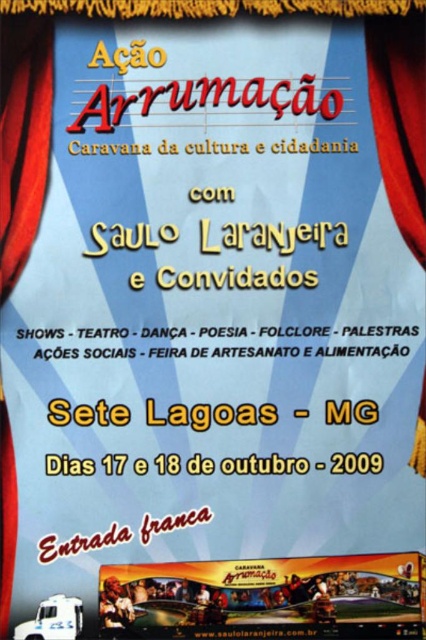
Based on the photo, you are designing a promotional poster and need to place a yellow fabric banner at lower center and a red velvet curtain at left. Based on the scene description, which object should be placed first to ensure proper scaling according to the design guidelines?

The yellow fabric banner at lower center should be placed first since it is larger in size than the red velvet curtain at left, ensuring proper scaling as per design guidelines.

You are an event planner standing at the front of the stage. You need to hang a new decorative element between the yellow fabric banner at lower center and the red velvet curtain at upper right. Based on their positions, which object is closer to you so you can decide where to place the new decoration?

The yellow fabric banner at lower center is closer to the viewer than the red velvet curtain at upper right, so you should place the new decorative element near the yellow fabric banner at lower center to maintain proximity.

What is the spatial relationship between the red velvet curtain at left and the red velvet curtain at upper right in the poster?

The red velvet curtain at left is positioned under the red velvet curtain at upper right.